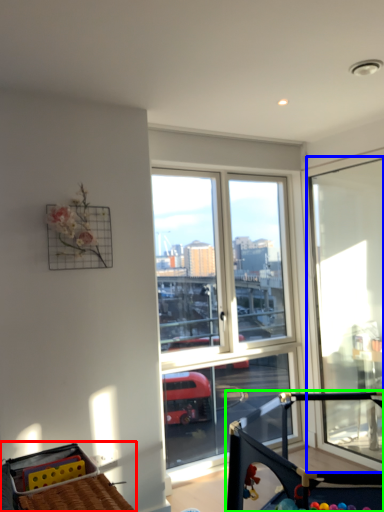
Question: Estimate the real-world distances between objects in this image. Which object is farther from baby carriage (highlighted by a red box), window (highlighted by a blue box) or baby carriage (highlighted by a green box)?

Choices:
 (A) window
 (B) baby carriage

Answer: (A)